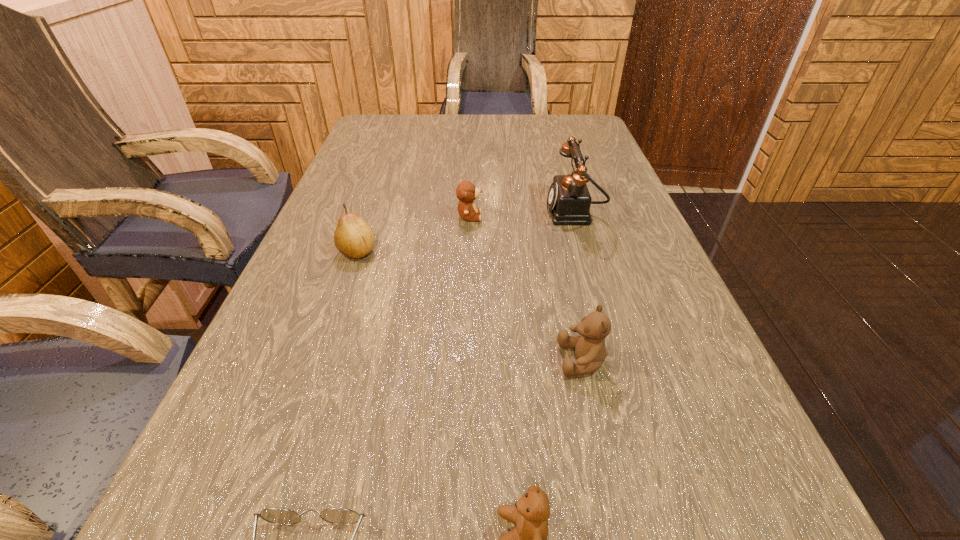
Identify the location of telephone. (569, 201).

Find the location of a particular element. The image size is (960, 540). pear is located at coordinates (353, 237).

At what (x,y) coordinates should I click in order to perform the action: click on the fourth farthest object. Please return your answer as a coordinate pair (x, y). This screenshot has height=540, width=960. Looking at the image, I should click on (590, 349).

Image resolution: width=960 pixels, height=540 pixels. In order to click on the second nearest teddy bear in this screenshot , I will do `click(590, 349)`.

At what (x,y) coordinates should I click in order to perform the action: click on the leftmost teddy bear. Please return your answer as a coordinate pair (x, y). Looking at the image, I should click on (466, 192).

The width and height of the screenshot is (960, 540). In order to click on the farthest teddy bear in this screenshot , I will do [x=466, y=192].

Where is `vacant space located 0.120m on the front of the telephone at the rotary dial`? This screenshot has width=960, height=540. vacant space located 0.120m on the front of the telephone at the rotary dial is located at coordinates (496, 213).

At what (x,y) coordinates should I click in order to perform the action: click on blank space located on the front of the telephone at the rotary dial. Please return your answer as a coordinate pair (x, y). The image size is (960, 540). Looking at the image, I should click on (526, 213).

Identify the location of free spot located 0.240m on the front of the telephone at the rotary dial. (445, 213).

I want to click on free space located 0.180m on the right of the fourth nearest object, so click(x=463, y=252).